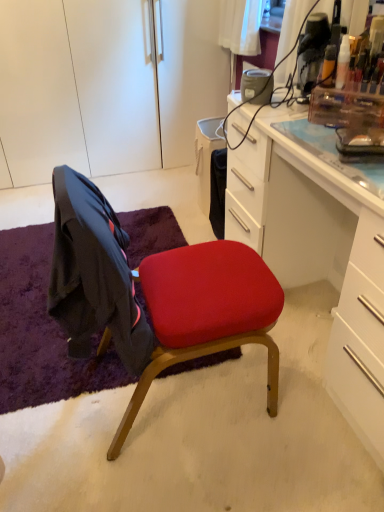
Question: Do you think matte red cushioned chair at center is within purple shaggy rug at lower left, or outside of it?

Choices:
 (A) inside
 (B) outside

Answer: (B)

Question: From a real-world perspective, is matte red cushioned chair at center positioned above or below purple shaggy rug at lower left?

Choices:
 (A) below
 (B) above

Answer: (B)

Question: Which is nearer to the matte red cushioned chair at center?

Choices:
 (A) white matte cabinet at upper left
 (B) white glossy desk at center
 (C) purple shaggy rug at lower left

Answer: (B)

Question: Which object is the closest to the purple shaggy rug at lower left?

Choices:
 (A) white glossy desk at center
 (B) matte red cushioned chair at center
 (C) white matte cabinet at upper left

Answer: (B)